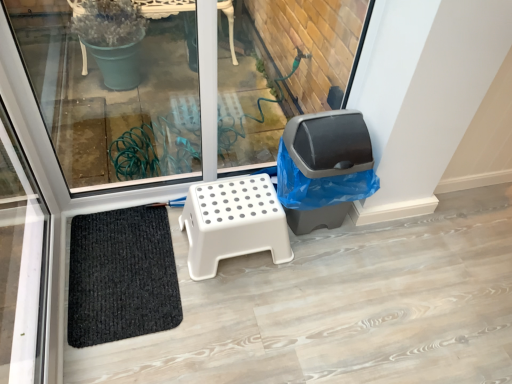
Question: Is white plastic stool at center further to camera compared to transparent glass window at center?

Choices:
 (A) no
 (B) yes

Answer: (B)

Question: Is white plastic stool at center not inside transparent glass window at center?

Choices:
 (A) no
 (B) yes

Answer: (B)

Question: Is white plastic stool at center smaller than transparent glass window at center?

Choices:
 (A) no
 (B) yes

Answer: (B)

Question: Does white plastic stool at center have a larger size compared to transparent glass window at center?

Choices:
 (A) no
 (B) yes

Answer: (A)

Question: From a real-world perspective, is white plastic stool at center physically below transparent glass window at center?

Choices:
 (A) yes
 (B) no

Answer: (A)

Question: Is gray plastic trash can at center right spatially inside black woven mat at lower left, or outside of it?

Choices:
 (A) outside
 (B) inside

Answer: (A)

Question: From the image's perspective, relative to black woven mat at lower left, is gray plastic trash can at center right above or below?

Choices:
 (A) above
 (B) below

Answer: (A)

Question: Considering the relative positions of gray plastic trash can at center right and black woven mat at lower left in the image provided, is gray plastic trash can at center right to the left or to the right of black woven mat at lower left?

Choices:
 (A) right
 (B) left

Answer: (A)

Question: Considering their positions, is gray plastic trash can at center right located in front of or behind black woven mat at lower left?

Choices:
 (A) behind
 (B) front

Answer: (B)

Question: Considering the positions of black woven mat at lower left and gray plastic trash can at center right in the image, is black woven mat at lower left taller or shorter than gray plastic trash can at center right?

Choices:
 (A) tall
 (B) short

Answer: (B)

Question: Based on their sizes in the image, would you say black woven mat at lower left is bigger or smaller than gray plastic trash can at center right?

Choices:
 (A) big
 (B) small

Answer: (B)

Question: Considering the positions of black woven mat at lower left and gray plastic trash can at center right in the image, is black woven mat at lower left wider or thinner than gray plastic trash can at center right?

Choices:
 (A) wide
 (B) thin

Answer: (A)

Question: Considering their positions, is black woven mat at lower left located in front of or behind gray plastic trash can at center right?

Choices:
 (A) behind
 (B) front

Answer: (A)

Question: Is white plastic stool at center in front of or behind gray plastic trash can at center right in the image?

Choices:
 (A) front
 (B) behind

Answer: (B)

Question: From the image's perspective, relative to gray plastic trash can at center right, is white plastic stool at center above or below?

Choices:
 (A) above
 (B) below

Answer: (B)